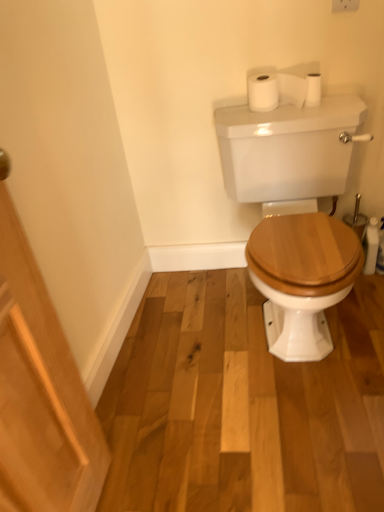
Locate an element on the screen. free point in front of white matte toilet paper at upper right, the first toilet paper when ordered from right to left is located at coordinates (317, 113).